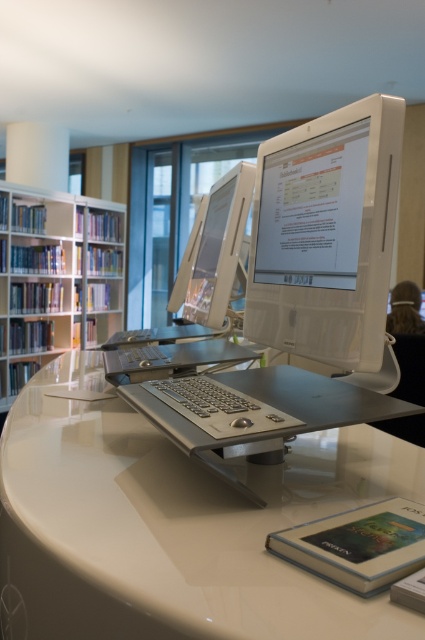
Question: Is white glossy monitor at center positioned in front of white glossy bookshelf at left?

Choices:
 (A) no
 (B) yes

Answer: (B)

Question: Estimate the real-world distances between objects in this image. Which object is farther from the white glossy monitor at center?

Choices:
 (A) white glossy computer desk at center
 (B) satin silver monitor at center

Answer: (B)

Question: Which point is closer to the camera taking this photo?

Choices:
 (A) (102, 568)
 (B) (214, 273)
 (C) (73, 280)

Answer: (A)

Question: Can you confirm if white glossy bookshelf at left is bigger than satin silver monitor at center?

Choices:
 (A) yes
 (B) no

Answer: (A)

Question: Which object appears closest to the camera in this image?

Choices:
 (A) white glossy monitor at center
 (B) white glossy computer desk at center
 (C) white glossy bookshelf at left
 (D) satin silver monitor at center

Answer: (B)

Question: Is white glossy computer desk at center to the right of white glossy monitor at center from the viewer's perspective?

Choices:
 (A) yes
 (B) no

Answer: (B)